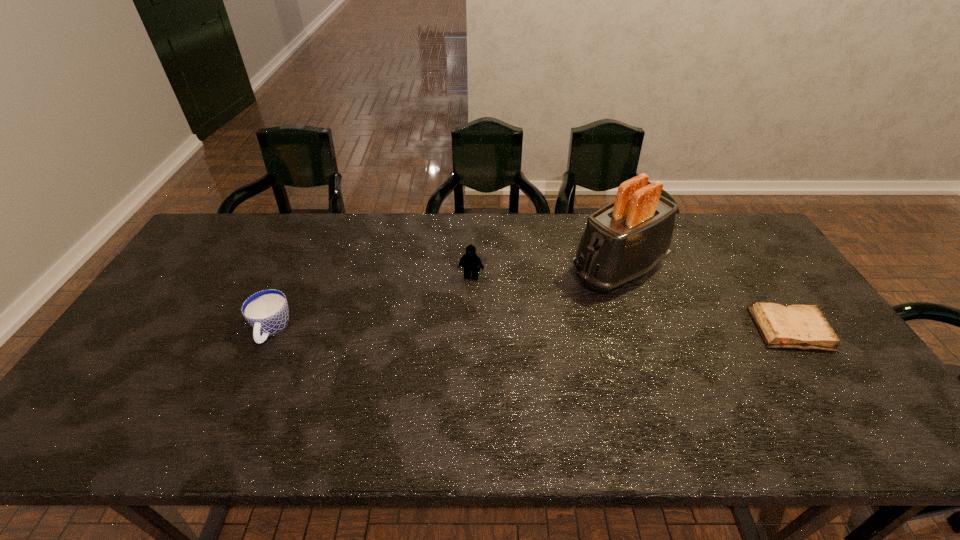
At what (x,y) coordinates should I click in order to perform the action: click on vacant region located 0.270m on the side of the tallest object with the control lever. Please return your answer as a coordinate pair (x, y). This screenshot has height=540, width=960. Looking at the image, I should click on (512, 328).

Locate an element on the screen. The height and width of the screenshot is (540, 960). free space located 0.250m on the side of the tallest object with the control lever is located at coordinates (517, 325).

Where is `free space located on the side of the tallest object with the control lever`? This screenshot has width=960, height=540. free space located on the side of the tallest object with the control lever is located at coordinates (492, 340).

At what (x,y) coordinates should I click in order to perform the action: click on vacant space situated 0.200m on the face of the third shortest object. Please return your answer as a coordinate pair (x, y). The width and height of the screenshot is (960, 540). Looking at the image, I should click on (453, 330).

Where is `vacant position located 0.050m on the face of the third shortest object`? The width and height of the screenshot is (960, 540). vacant position located 0.050m on the face of the third shortest object is located at coordinates (465, 292).

At what (x,y) coordinates should I click in order to perform the action: click on vacant space located on the face of the third shortest object. Please return your answer as a coordinate pair (x, y). Looking at the image, I should click on (440, 372).

Where is `object located at the far edge`? The image size is (960, 540). object located at the far edge is located at coordinates (625, 239).

You are a GUI agent. You are given a task and a screenshot of the screen. Output one action in this format:
    pyautogui.click(x=<x>, y=<y>)
    Task: Click on the object positioned at the right edge
    This screenshot has height=540, width=960.
    Given the screenshot: What is the action you would take?
    (x=804, y=327)

In the image, there is a desktop. Where is `free region at the far edge`? The height and width of the screenshot is (540, 960). free region at the far edge is located at coordinates (532, 217).

Locate an element on the screen. This screenshot has height=540, width=960. vacant space at the near edge of the desktop is located at coordinates (497, 376).